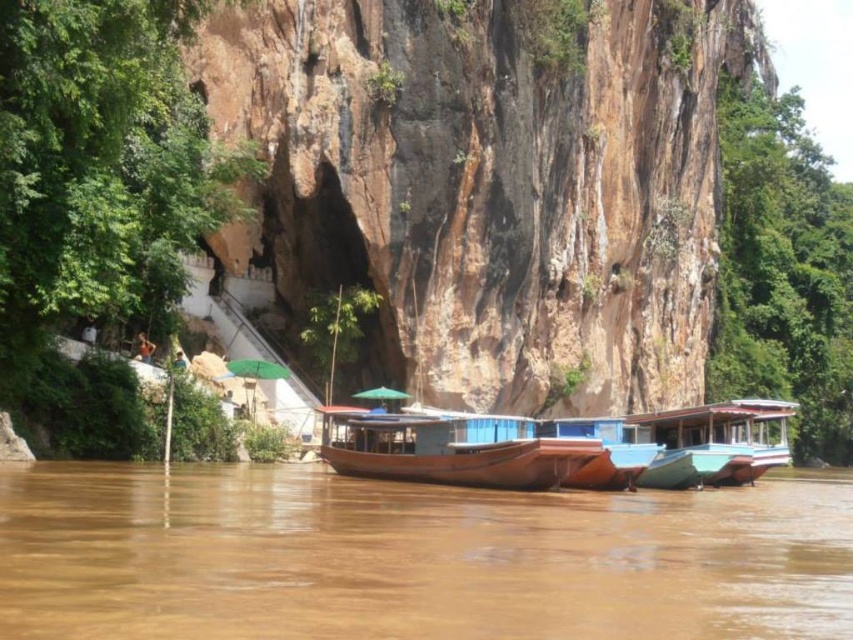
Is point (250, 122) in front of point (0, 468)?

No.

Describe the element at coordinates (486, 188) in the screenshot. I see `brown rock cliff at center` at that location.

Where is `brown rock cliff at center`? The image size is (853, 640). brown rock cliff at center is located at coordinates (486, 188).